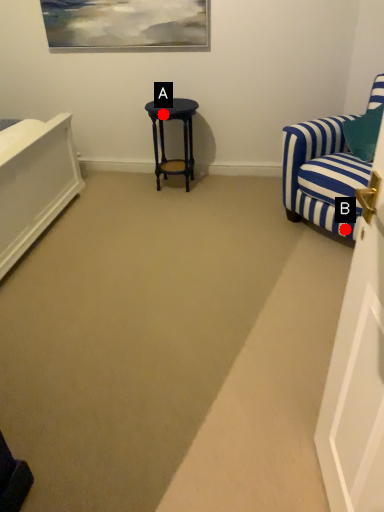
Question: Two points are circled on the image, labeled by A and B beside each circle. Which of the following is the closest to the observer?

Choices:
 (A) A is closer
 (B) B is closer

Answer: (B)